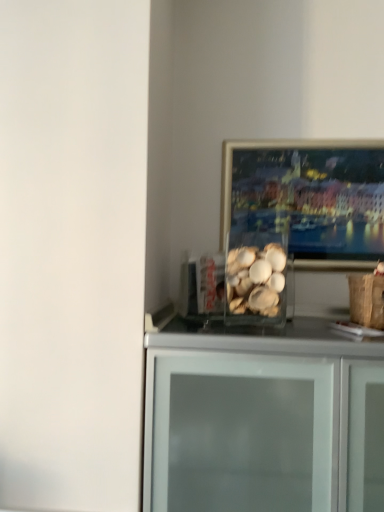
What do you see at coordinates (255, 279) in the screenshot? The width and height of the screenshot is (384, 512). I see `translucent glass shells at center` at bounding box center [255, 279].

In order to face translucent glass shells at center, should I rotate leftwards or rightwards?

A 7.673 degree turn to the right will do.

Measure the distance between point (264, 298) and camera.

1.04 meters.

Find the location of `translucent glass shells at center`. translucent glass shells at center is located at coordinates click(x=255, y=279).

At what (x,y) coordinates should I click in order to perform the action: click on translucent glass shells at center. Please return your answer as a coordinate pair (x, y). Looking at the image, I should click on (255, 279).